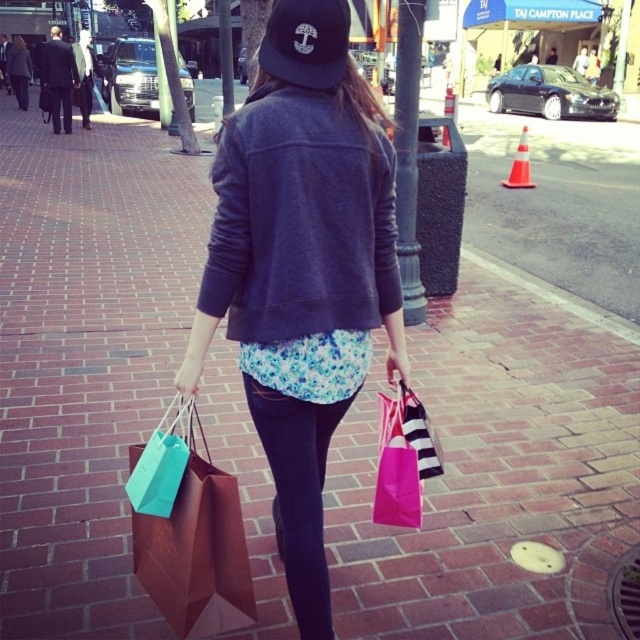
Consider the image. You are standing at the center of the sidewalk and see the brown paper bag at lower left. Where is the brown paper bag located relative to your position?

The brown paper bag at lower left is located at point 0.839 on the x axis and 0.300 on the y axis relative to the image frame.

You are standing at the point labeled as point (x=138, y=492) and want to walk to the point labeled as point (x=346, y=12). Which direction should you move relative to the person carrying the shopping bags?

You should move in the direction towards the person carrying the shopping bags since point (x=346, y=12) is in front of point (x=138, y=492) relative to the person.